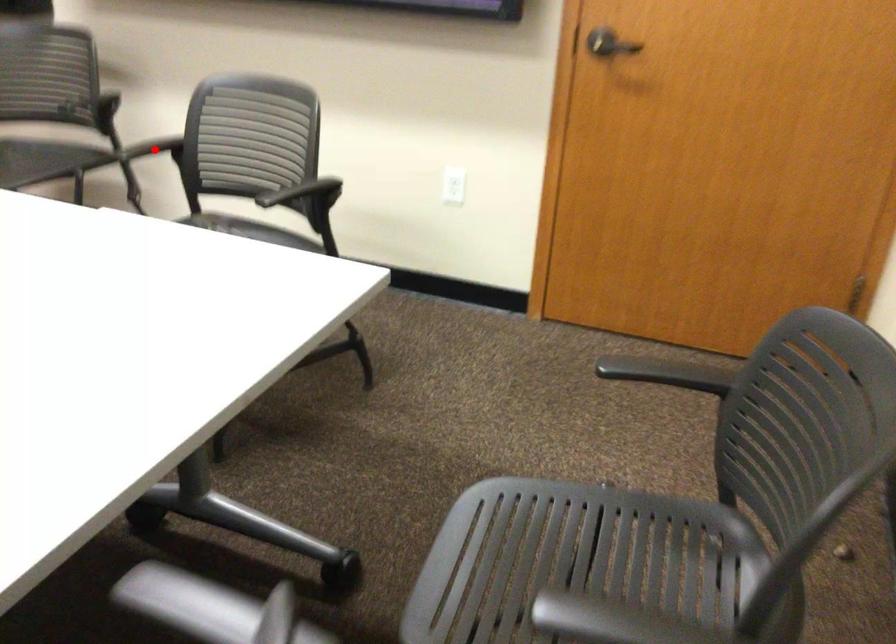
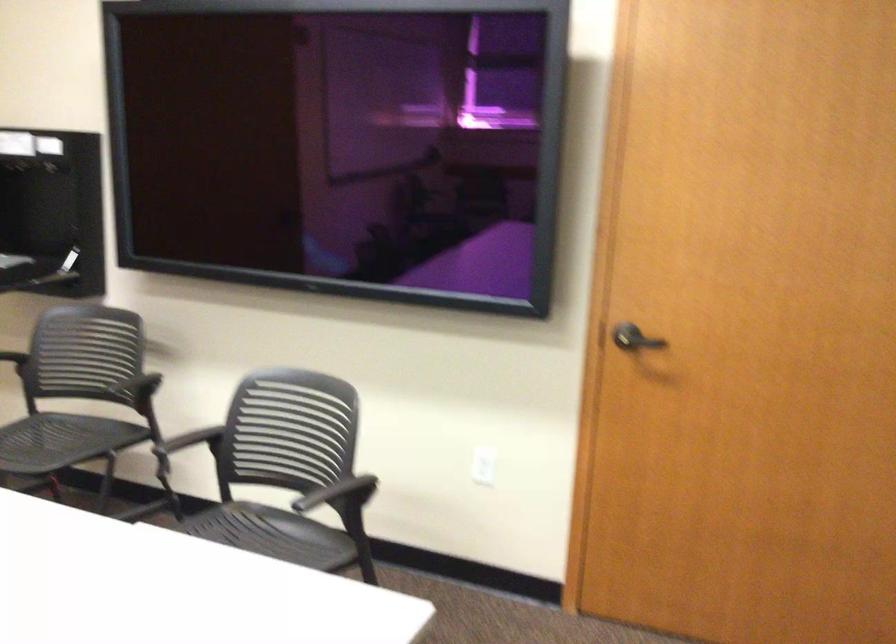
In the second image, find the point that corresponds to the highlighted location in the first image.

(191, 440)